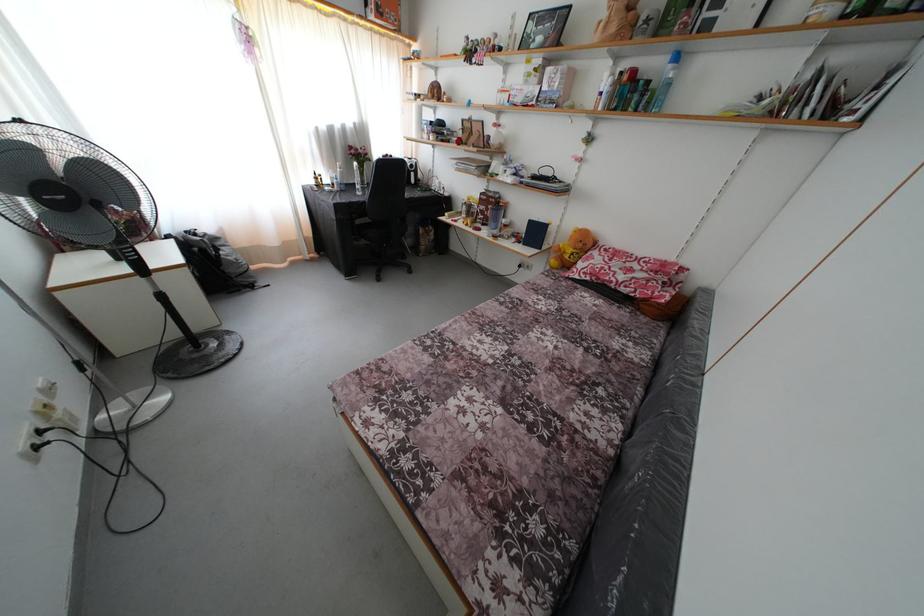
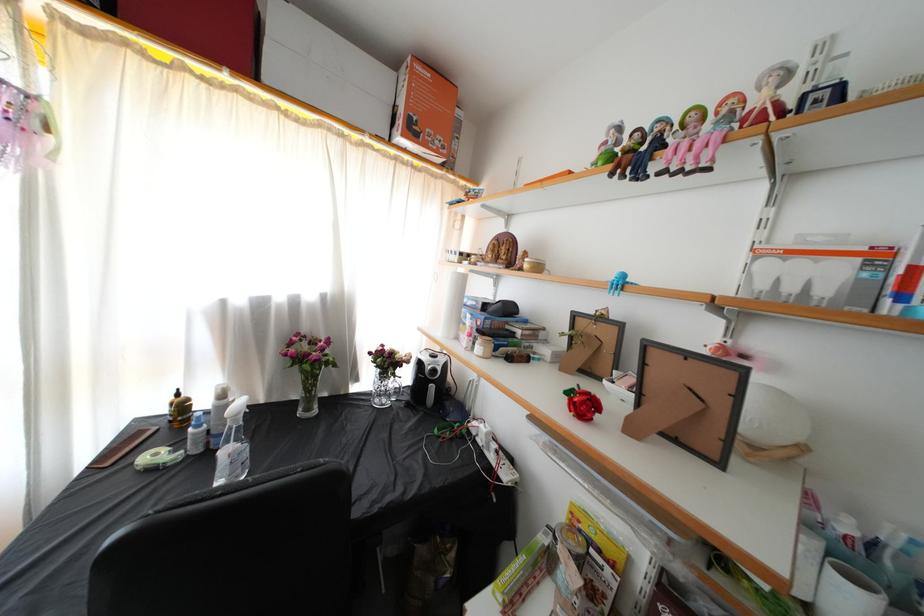
Find the pixel in the second image that matches pixel 318 187 in the first image.

(171, 416)